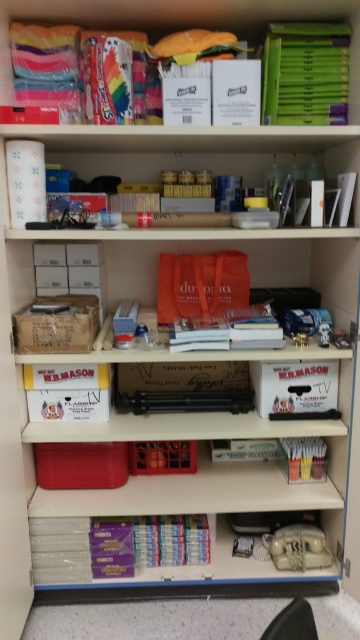
You are organizing the shelf and want to place a new item between the white paper towel at upper center and the purple matte book at lower center. Is there enough vertical space between them to fit a 10cm thick item?

The white paper towel at upper center is above the purple matte book at lower center, but the vertical distance between them isn not specified. Without knowing the exact gap, it is impossible to determine if a 10cm thick item can fit between them.

Looking at this image, you are standing in front of the shelf and want to reach both the point at (29, 134) and the point at (105, 541). Which point is closer to you?

The point at (29, 134) is closer to you because it is in front of the point at (105, 541).

You are organizing books on a shelf and have to place the matte plastic book at upper center and the purple matte book at lower center. Which book requires a wider space on the shelf?

The matte plastic book at upper center requires a wider space on the shelf because its width is larger than the purple matte book at lower center.